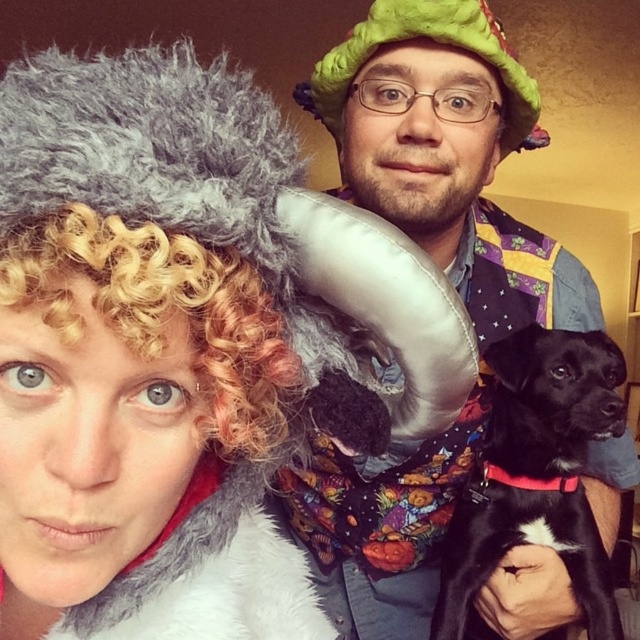
Question: Which point appears closest to the camera in this image?

Choices:
 (A) (241, 362)
 (B) (600, 358)

Answer: (A)

Question: Does fluffy gray wig at upper left have a lesser width compared to black smooth dog at center?

Choices:
 (A) yes
 (B) no

Answer: (B)

Question: Can you confirm if fluffy gray wig at upper left is bigger than curly blonde wig at upper left?

Choices:
 (A) no
 (B) yes

Answer: (B)

Question: Which of the following is the farthest from the observer?

Choices:
 (A) (371, 140)
 (B) (582, 506)

Answer: (B)

Question: Estimate the real-world distances between objects in this image. Which object is farther from the fluffy gray wig at upper left?

Choices:
 (A) black smooth dog at center
 (B) curly blonde wig at upper left

Answer: (B)

Question: Does fluffy gray wig at upper left have a lesser width compared to black smooth dog at center?

Choices:
 (A) no
 (B) yes

Answer: (A)